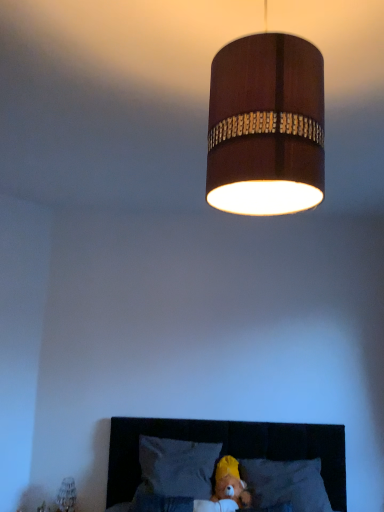
Question: Should I look upward or downward to see gray fabric pillow at lower center, which appears as the first pillow when viewed from the right?

Choices:
 (A) up
 (B) down

Answer: (B)

Question: Is wooden cylinder at upper center beside dark gray fabric pillow at lower center, which is counted as the first pillow, starting from the left?

Choices:
 (A) no
 (B) yes

Answer: (A)

Question: Can you confirm if wooden cylinder at upper center is positioned to the right of dark gray fabric pillow at lower center, acting as the 2th pillow starting from the right?

Choices:
 (A) no
 (B) yes

Answer: (A)

Question: Is wooden cylinder at upper center behind dark gray fabric pillow at lower center, acting as the 2th pillow starting from the right?

Choices:
 (A) no
 (B) yes

Answer: (B)

Question: Is there a large distance between wooden cylinder at upper center and dark gray fabric pillow at lower center, acting as the 2th pillow starting from the right?

Choices:
 (A) no
 (B) yes

Answer: (A)

Question: Is wooden cylinder at upper center wider than dark gray fabric pillow at lower center, acting as the 2th pillow starting from the right?

Choices:
 (A) yes
 (B) no

Answer: (B)

Question: Considering the relative sizes of wooden cylinder at upper center and dark gray fabric pillow at lower center, acting as the 2th pillow starting from the right, in the image provided, is wooden cylinder at upper center smaller than dark gray fabric pillow at lower center, acting as the 2th pillow starting from the right,?

Choices:
 (A) yes
 (B) no

Answer: (A)

Question: Is velvet dark brown headboard at lower center shorter than yellow plush at lower center?

Choices:
 (A) no
 (B) yes

Answer: (A)

Question: From the image's perspective, is velvet dark brown headboard at lower center located beneath yellow plush at lower center?

Choices:
 (A) yes
 (B) no

Answer: (B)

Question: Are velvet dark brown headboard at lower center and yellow plush at lower center making contact?

Choices:
 (A) no
 (B) yes

Answer: (A)

Question: Is velvet dark brown headboard at lower center positioned beyond the bounds of yellow plush at lower center?

Choices:
 (A) yes
 (B) no

Answer: (A)

Question: Is velvet dark brown headboard at lower center to the left of yellow plush at lower center from the viewer's perspective?

Choices:
 (A) yes
 (B) no

Answer: (B)

Question: Is velvet dark brown headboard at lower center positioned far away from yellow plush at lower center?

Choices:
 (A) yes
 (B) no

Answer: (B)

Question: Is velvet dark brown headboard at lower center shorter than wooden lampshade at upper center?

Choices:
 (A) no
 (B) yes

Answer: (A)